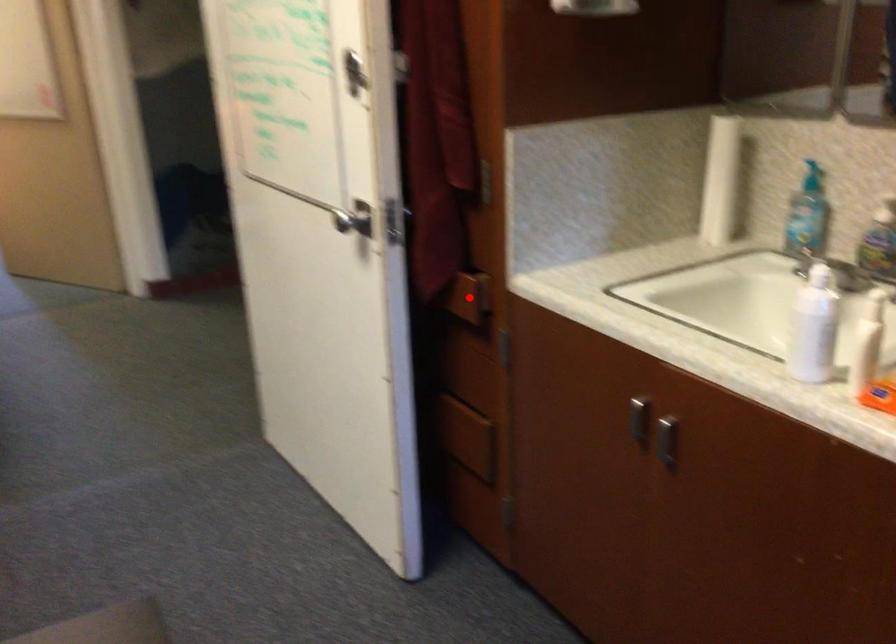
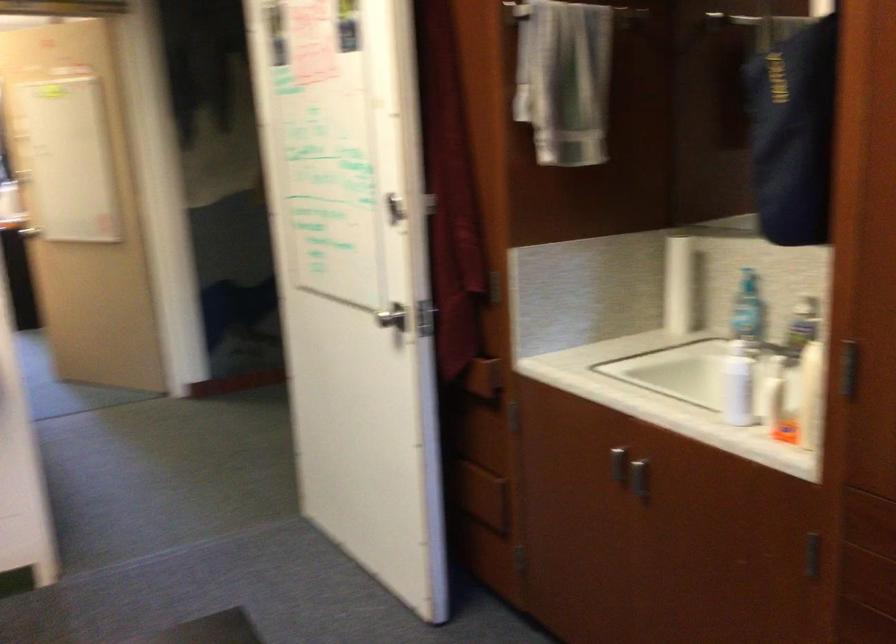
Question: I am providing you with two images of the same scene from different viewpoints. Image1 has a red point marked. In image2, the corresponding 3D location appears at what relative position? Reply with the corresponding letter.

Choices:
 (A) Closer
 (B) Farther

Answer: (B)